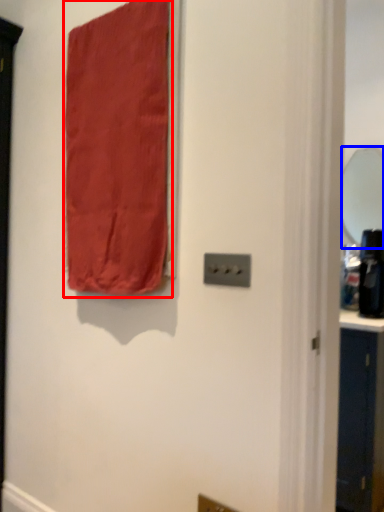
Question: Among these objects, which one is nearest to the camera, curtain (highlighted by a red box) or mirror (highlighted by a blue box)?

Choices:
 (A) curtain
 (B) mirror

Answer: (A)